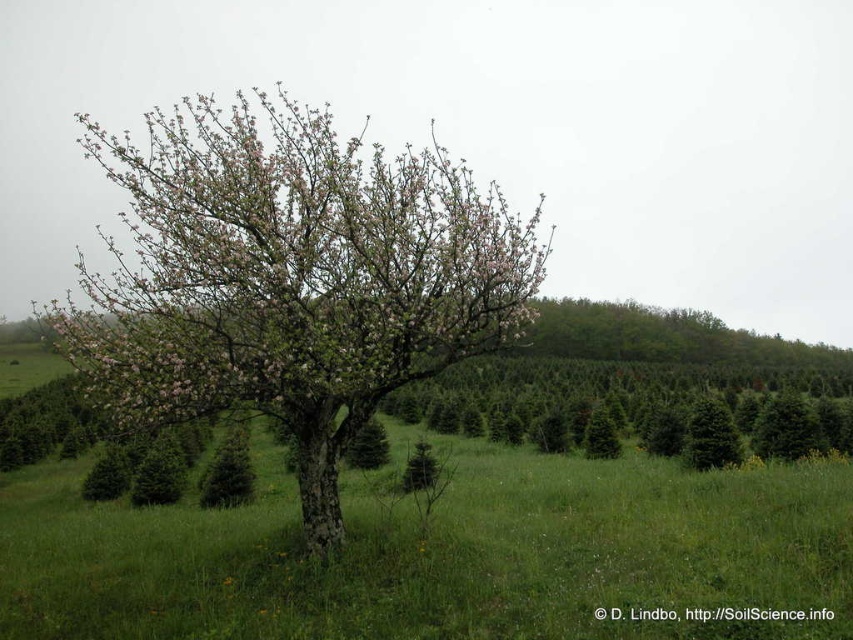
Question: Observing the image, what is the correct spatial positioning of green grassy at center in reference to pink bloom at center?

Choices:
 (A) right
 (B) left

Answer: (A)

Question: Which point is closer to the camera taking this photo?

Choices:
 (A) coord(422,611)
 (B) coord(71,348)

Answer: (A)

Question: Is green grassy at center below pink bloom at center?

Choices:
 (A) yes
 (B) no

Answer: (A)

Question: Which of the following is the farthest from the observer?

Choices:
 (A) green grassy at center
 (B) pink bloom at center

Answer: (B)

Question: Is green grassy at center to the left of pink bloom at center from the viewer's perspective?

Choices:
 (A) no
 (B) yes

Answer: (A)

Question: Among these objects, which one is nearest to the camera?

Choices:
 (A) pink bloom at center
 (B) green grassy at center

Answer: (B)